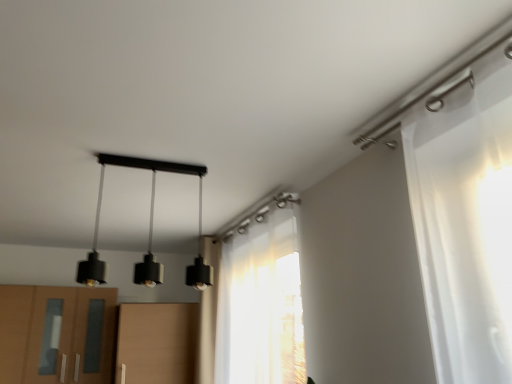
Question: From a real-world perspective, is matte brown cabinet at lower left above or below translucent white curtain at center?

Choices:
 (A) below
 (B) above

Answer: (A)

Question: Choose the correct answer: Is matte brown cabinet at lower left inside translucent white curtain at center or outside it?

Choices:
 (A) inside
 (B) outside

Answer: (B)

Question: Estimate the real-world distances between objects in this image. Which object is farther from the black matte pendant lights at center?

Choices:
 (A) matte brown cabinet at lower left
 (B) translucent white curtain at center

Answer: (B)

Question: Which object is positioned closest to the black matte pendant lights at center?

Choices:
 (A) matte brown cabinet at lower left
 (B) translucent white curtain at center

Answer: (A)